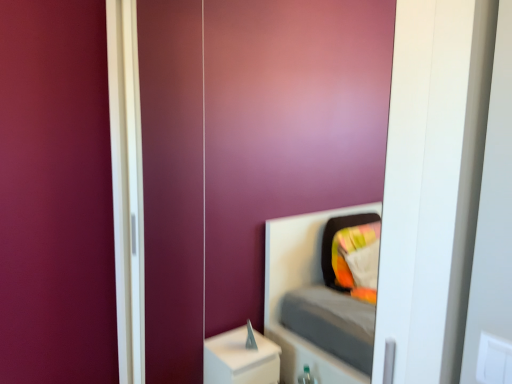
The width and height of the screenshot is (512, 384). What do you see at coordinates (248, 148) in the screenshot?
I see `white glossy screen door at center` at bounding box center [248, 148].

Find the location of a particular element. Image resolution: width=512 pixels, height=384 pixels. white glossy screen door at center is located at coordinates [x=248, y=148].

Locate an element on the screen. white glossy screen door at center is located at coordinates (248, 148).